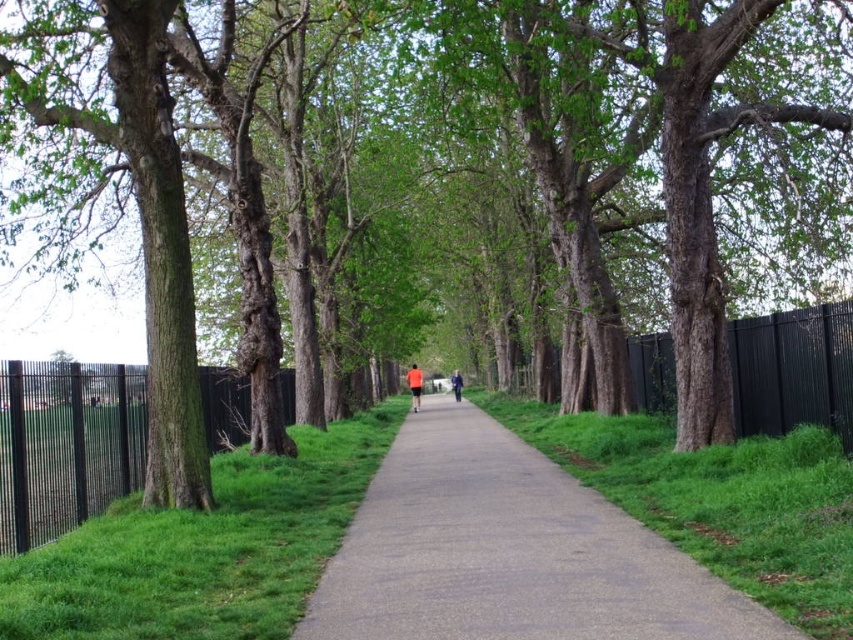
Question: Does gray asphalt path at center have a smaller size compared to orange fabric at center?

Choices:
 (A) no
 (B) yes

Answer: (B)

Question: Is gray asphalt path at center bigger than green grass at lower left?

Choices:
 (A) yes
 (B) no

Answer: (B)

Question: Observing the image, what is the correct spatial positioning of green grass at lower left in reference to orange fabric jacket at center?

Choices:
 (A) below
 (B) above

Answer: (B)

Question: Which object is farther from the camera taking this photo?

Choices:
 (A) orange fabric jacket at center
 (B) orange fabric at center
 (C) gray asphalt path at center
 (D) green grass at lower left

Answer: (A)

Question: Among these points, which one is farthest from the camera?

Choices:
 (A) (419, 524)
 (B) (451, 388)

Answer: (B)

Question: Which object is positioned farthest from the green grass at lower left?

Choices:
 (A) orange fabric at center
 (B) orange fabric jacket at center

Answer: (B)